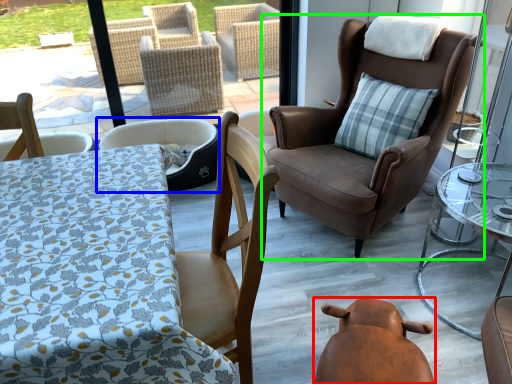
Question: Considering the real-world distances, which object is farthest from swivel chair (highlighted by a red box)? chair (highlighted by a blue box) or chair (highlighted by a green box)?

Choices:
 (A) chair
 (B) chair

Answer: (A)